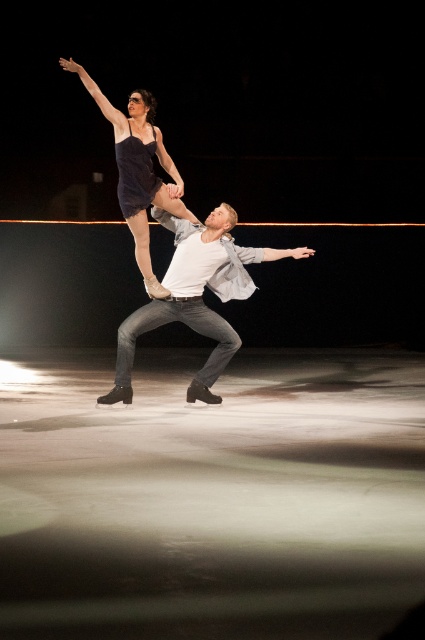
You are a photographer at the edge of the ice rink. You want to take a photo of both the white matte shirt at center and the matte black leotard at upper center. Which one will appear closer to the front of the photo?

The white matte shirt at center will appear closer to the front of the photo because the matte black leotard at upper center is positioned behind it.

You are a photographer capturing the skaters from the audience. You want to ensure both the white matte shirt at center and the matte black leotard at upper center are clearly visible in your photo. Considering their sizes, which one might require more careful framing to avoid being too small in the shot?

The matte black leotard at upper center might require more careful framing because it is smaller in size compared to the white matte shirt at center, so it could appear too small in the photo if not positioned properly.

You are a photographer positioned at the origin point of the coordinate system. You want to take a photo of the white matte shirt at center. What are the coordinates where you should aim your camera?

The white matte shirt at center is located at point coordinates of (195, 296). Therefore, you should aim your camera at those coordinates to capture the white matte shirt at center.